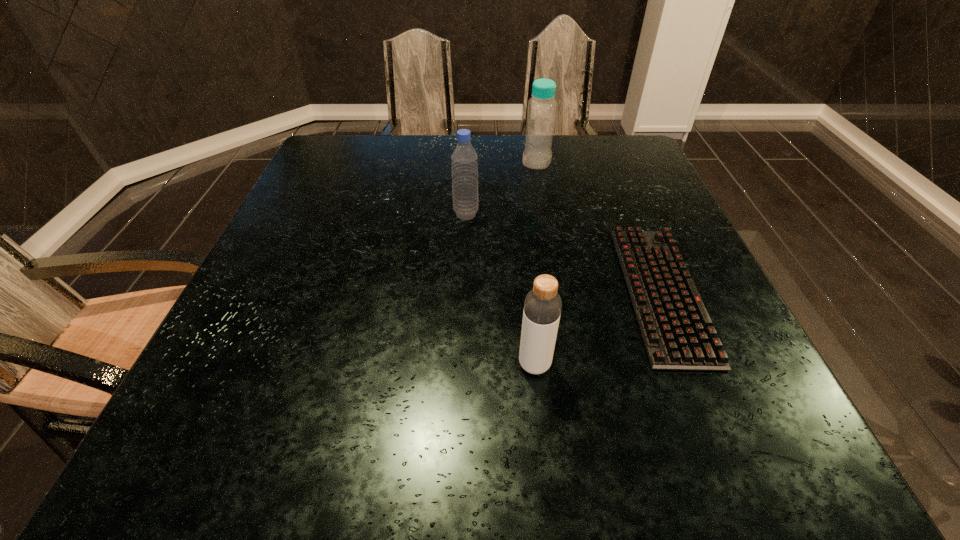
Locate an element on the screen. object that is the third closest to the rightmost object is located at coordinates (464, 161).

The width and height of the screenshot is (960, 540). Find the location of `the second closest bottle to the leftmost bottle`. the second closest bottle to the leftmost bottle is located at coordinates (542, 307).

Find the location of `the closest bottle to the farthest bottle`. the closest bottle to the farthest bottle is located at coordinates (464, 161).

You are a GUI agent. You are given a task and a screenshot of the screen. Output one action in this format:
    pyautogui.click(x=<x>, y=<y>)
    Task: Click on the vacant space that satisfies the following two spatial constraints: 1. on the back side of the nearest bottle; 2. on the left side of the computer keyboard
    The image size is (960, 540).
    Given the screenshot: What is the action you would take?
    pyautogui.click(x=527, y=292)

Where is `free location that satisfies the following two spatial constraints: 1. on the back side of the farthest object; 2. on the left side of the second farthest object`? The width and height of the screenshot is (960, 540). free location that satisfies the following two spatial constraints: 1. on the back side of the farthest object; 2. on the left side of the second farthest object is located at coordinates (468, 161).

I want to click on vacant region that satisfies the following two spatial constraints: 1. on the back side of the farthest bottle; 2. on the right side of the nearest bottle, so click(513, 161).

The width and height of the screenshot is (960, 540). In order to click on vacant space that satisfies the following two spatial constraints: 1. on the front side of the nearest bottle; 2. on the right side of the second farthest bottle in this screenshot , I will do `click(460, 364)`.

The image size is (960, 540). In order to click on vacant space that satisfies the following two spatial constraints: 1. on the front side of the shortest object; 2. on the left side of the farthest bottle in this screenshot , I will do `click(561, 292)`.